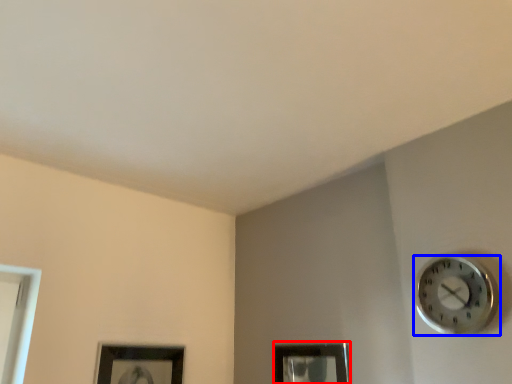
Question: Which of the following is the farthest to the observer, picture frame (highlighted by a red box) or wall clock (highlighted by a blue box)?

Choices:
 (A) picture frame
 (B) wall clock

Answer: (A)